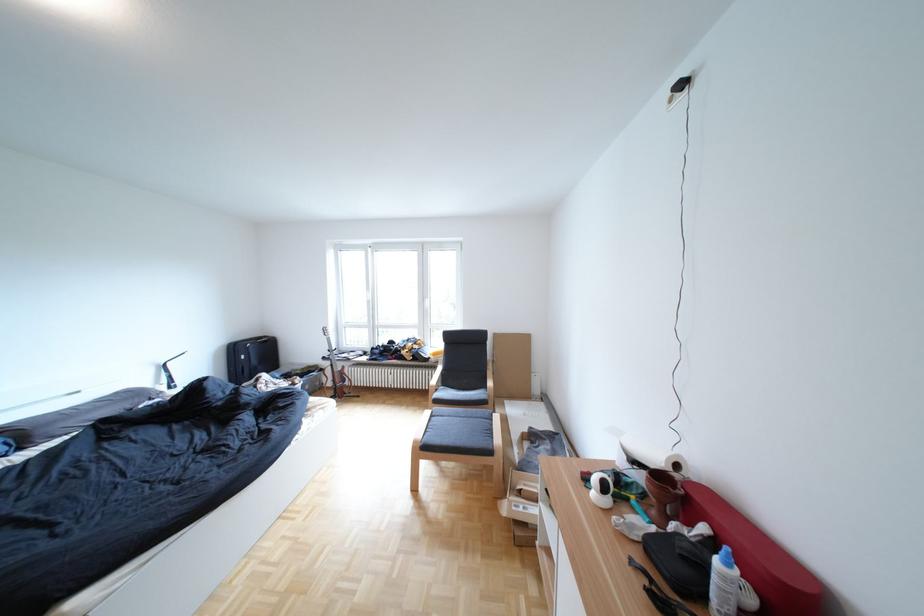
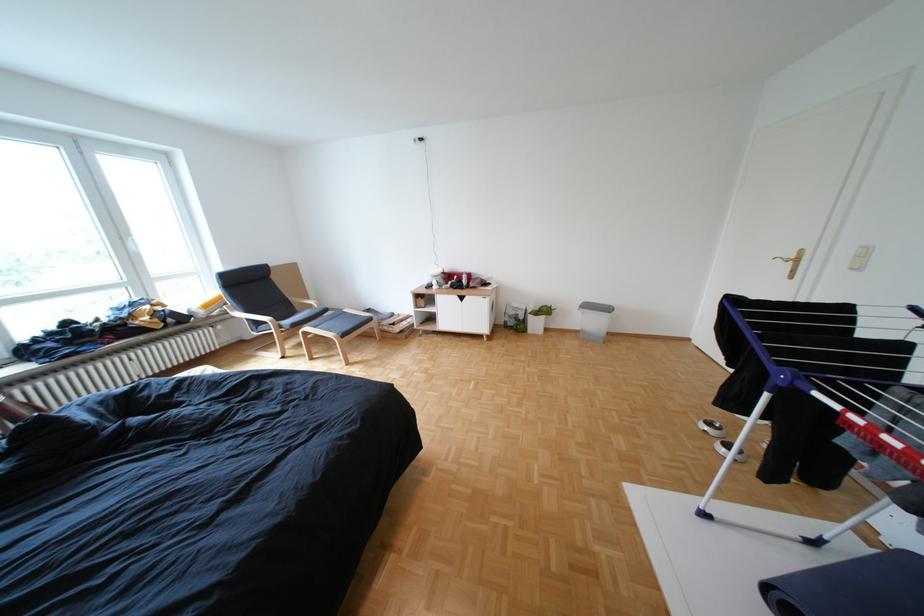
The point at (x=687, y=525) is marked in the first image. Where is the corresponding point in the second image?

(466, 283)